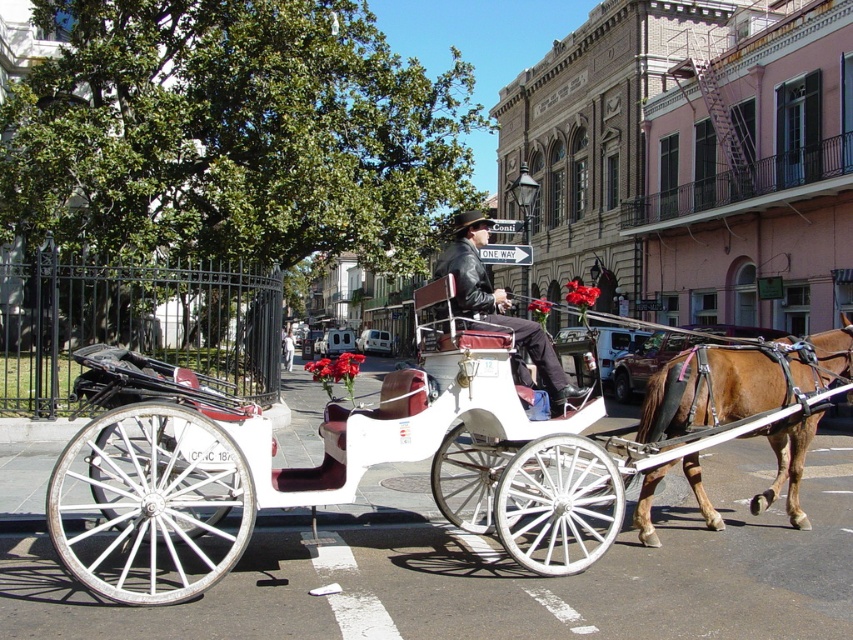
Question: Is white polished wood cart at center positioned in front of leather jacket at center?

Choices:
 (A) yes
 (B) no

Answer: (A)

Question: Based on their relative distances, which object is farther from the white fabric pants at center?

Choices:
 (A) brown glossy horse at right
 (B) leather jacket at center
 (C) white polished wood cart at center

Answer: (A)

Question: Can you confirm if brown glossy horse at right is positioned below leather jacket at center?

Choices:
 (A) yes
 (B) no

Answer: (A)

Question: Is leather jacket at center below white fabric pants at center?

Choices:
 (A) yes
 (B) no

Answer: (B)

Question: Which point is farther to the camera?

Choices:
 (A) white polished wood cart at center
 (B) brown glossy horse at right

Answer: (B)

Question: Which point is farther to the camera?

Choices:
 (A) brown glossy horse at right
 (B) white polished wood cart at center

Answer: (A)